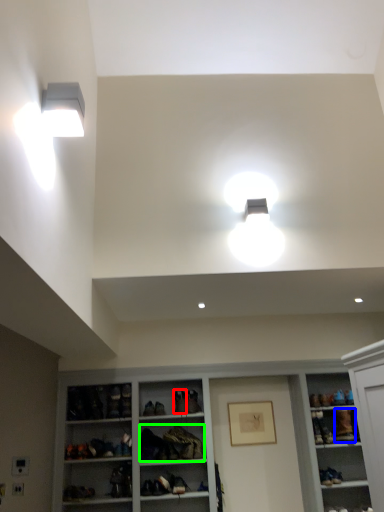
Question: Estimate the real-world distances between objects in this image. Which object is closer to shoe (highlighted by a red box), shoe (highlighted by a blue box) or clothing (highlighted by a green box)?

Choices:
 (A) shoe
 (B) clothing

Answer: (B)